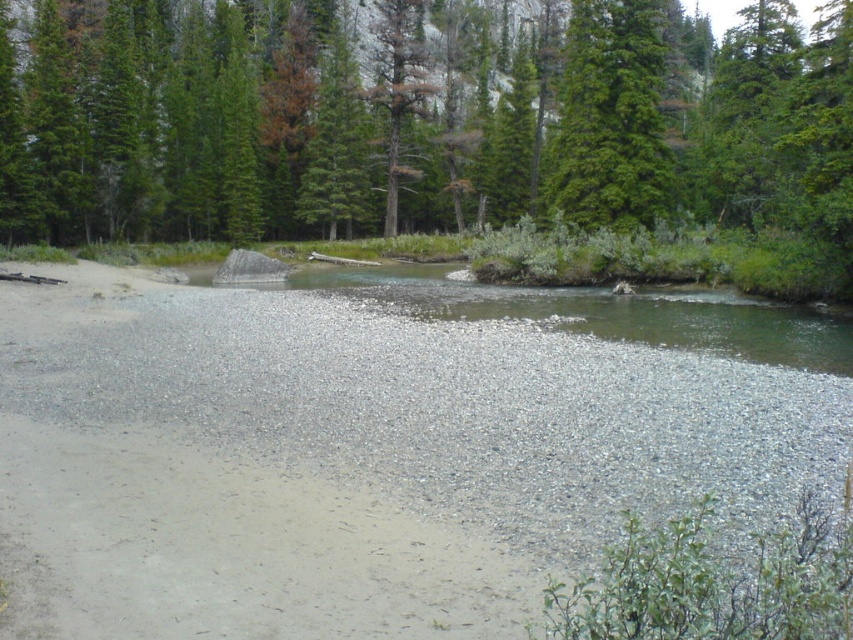
You are a hiker trying to cross the riverbed. You see the gray gravel at center and the green textured tree at upper right. Which object is located closer to the ground?

The gray gravel at center is positioned under the green textured tree at upper right, so the gray gravel at center is closer to the ground.

You are hiking along a riverbed and see the gray gravel at center and the green textured tree at upper right. Which object is positioned to the right side of the other?

The gray gravel at center is to the left of green textured tree at upper right, so the green textured tree at upper right is positioned to the right side of the gray gravel at center.

You are a hiker trying to cross the riverbed. You see the gray gravel at center and the green textured tree at upper right. Which path would allow you to walk without getting your shoes wet?

The gray gravel at center is wider than the green textured tree at upper right, so walking on the gray gravel at center would be better to avoid getting your shoes wet since it has more space and is likely dry ground.